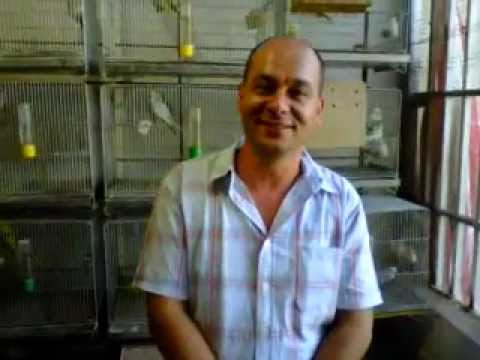
This screenshot has height=360, width=480. Find the location of `window panes`. window panes is located at coordinates (465, 223).